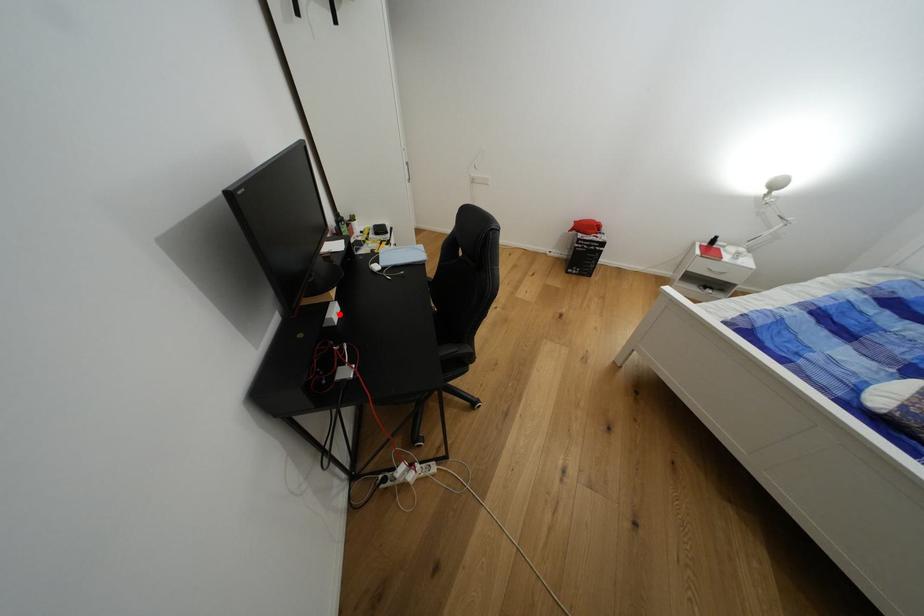
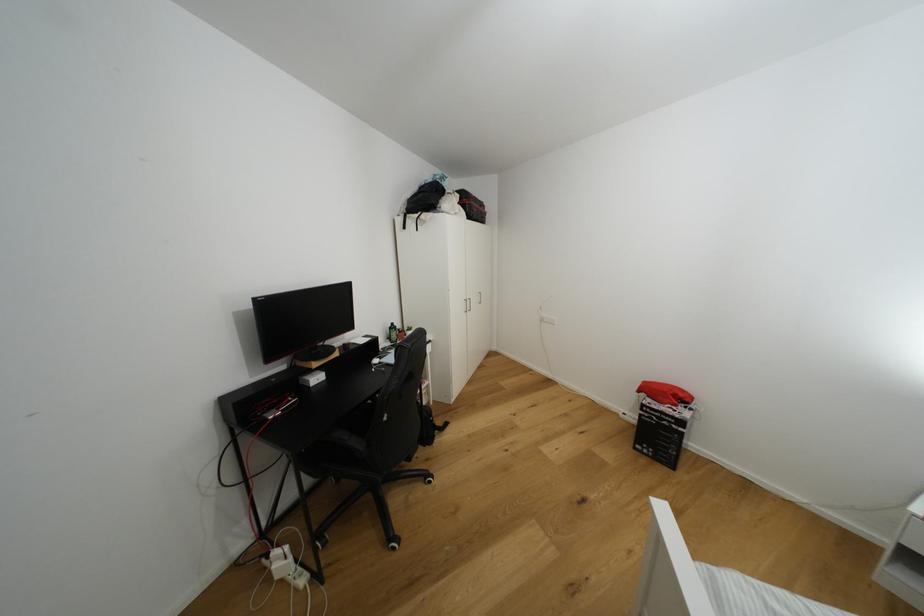
Question: I am providing you with two images of the same scene from different viewpoints. Given a red point in image1, look at the same physical point in image2. Is it:

Choices:
 (A) Closer to the viewpoint
 (B) Farther from the viewpoint

Answer: (B)